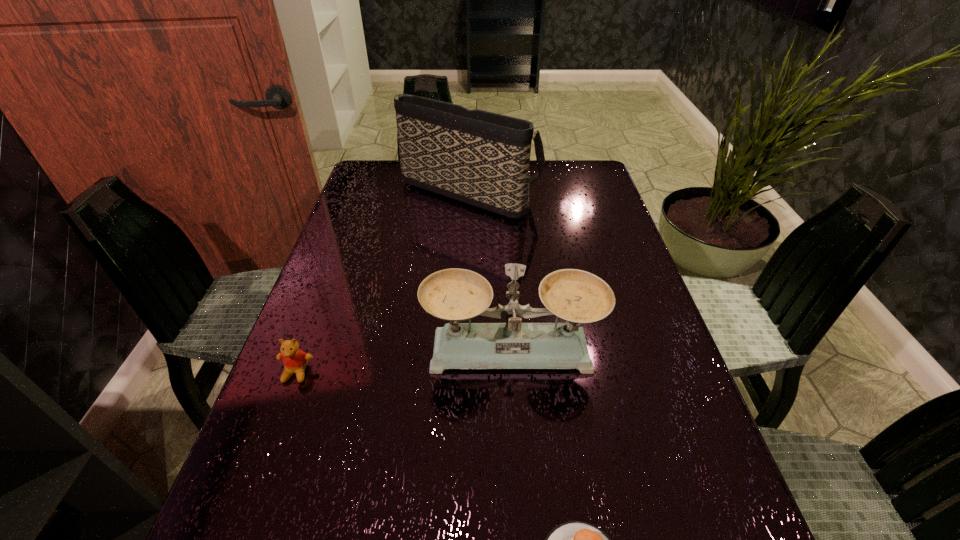
Find the location of a particular element. the tallest object is located at coordinates (481, 158).

Where is `the farthest object`? Image resolution: width=960 pixels, height=540 pixels. the farthest object is located at coordinates (481, 158).

Locate an element on the screen. Image resolution: width=960 pixels, height=540 pixels. scale is located at coordinates (577, 296).

You are a GUI agent. You are given a task and a screenshot of the screen. Output one action in this format:
    pyautogui.click(x=<x>, y=<y>)
    Task: Click on the third tallest object
    Image resolution: width=960 pixels, height=540 pixels.
    Given the screenshot: What is the action you would take?
    pyautogui.click(x=295, y=360)

Identify the location of the leftmost object. (295, 360).

Image resolution: width=960 pixels, height=540 pixels. I want to click on vacant space situated 0.100m on the front of the farthest object, so click(x=468, y=244).

Identify the location of vacant space located on the front-facing side of the second tallest object. Image resolution: width=960 pixels, height=540 pixels. (518, 437).

This screenshot has width=960, height=540. I want to click on vacant space situated on the front-facing side of the teddy bear, so click(x=240, y=525).

Locate an element on the screen. object that is at the far edge is located at coordinates 481,158.

Locate an element on the screen. handbag positioned at the left edge is located at coordinates (481, 158).